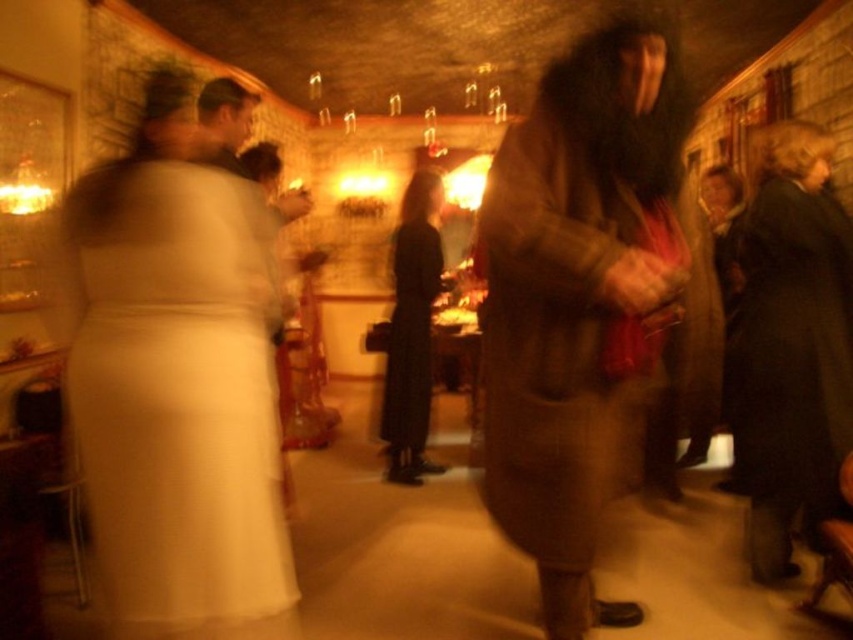
Is dark brown coat at right in front of black matte dress at center?

That is True.

Measure the distance between point (791, 502) and camera.

Point (791, 502) and camera are 8.61 feet apart from each other.

What do you see at coordinates (793, 339) in the screenshot?
I see `dark brown coat at right` at bounding box center [793, 339].

Find the location of a particular element. The width and height of the screenshot is (853, 640). dark brown coat at right is located at coordinates coord(793,339).

Does brown textured coat at center have a lesser height compared to dark brown coat at right?

Incorrect, brown textured coat at center's height does not fall short of dark brown coat at right's.

Which of these two, brown textured coat at center or dark brown coat at right, stands shorter?

With less height is dark brown coat at right.

Is point (643, 369) behind point (811, 518)?

No.

At what (x,y) coordinates should I click in order to perform the action: click on brown textured coat at center. Please return your answer as a coordinate pair (x, y). The height and width of the screenshot is (640, 853). Looking at the image, I should click on (578, 300).

Measure the distance between point (666, 124) and camera.

1.94 meters

Is brown textured coat at center closer to the viewer compared to black matte dress at center?

That is True.

Measure the distance between point (519, 500) and camera.

A distance of 1.95 meters exists between point (519, 500) and camera.

The width and height of the screenshot is (853, 640). What are the coordinates of `brown textured coat at center` in the screenshot? It's located at (578, 300).